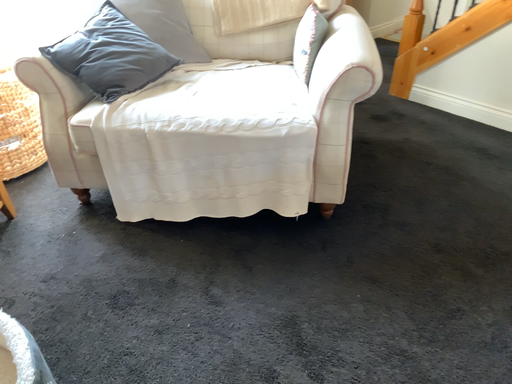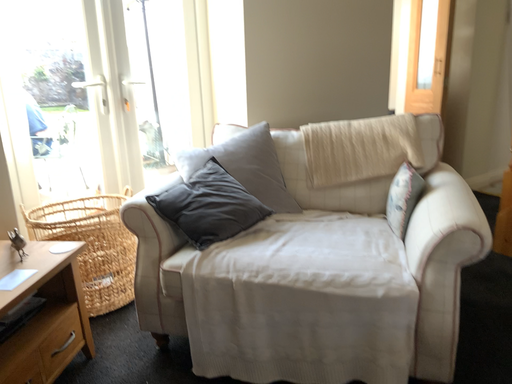
Question: How did the camera likely rotate when shooting the video?

Choices:
 (A) rotated downward
 (B) rotated upward

Answer: (B)